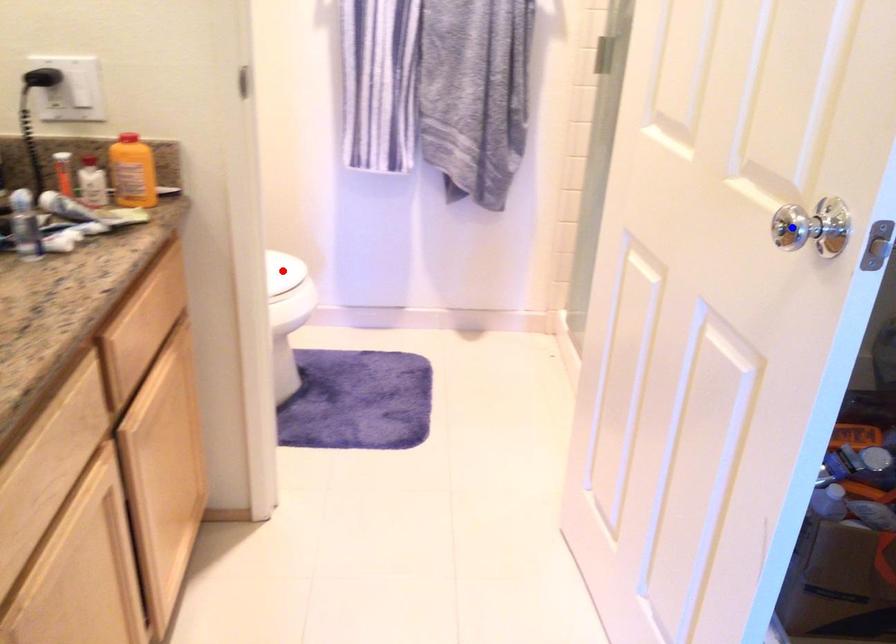
Question: Which of the two points in the image is closer to the camera?

Choices:
 (A) Blue point is closer.
 (B) Red point is closer.

Answer: (A)